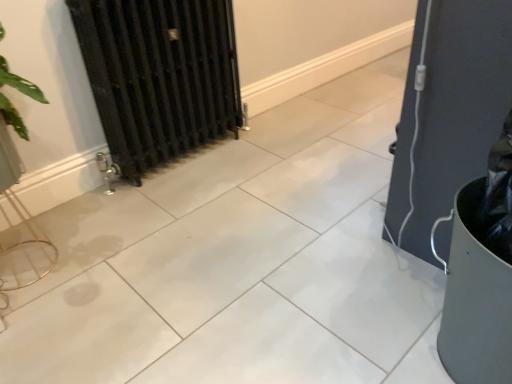
Question: Does matte black guitar case at right appear on the left side of black metal radiator at left?

Choices:
 (A) no
 (B) yes

Answer: (A)

Question: Is black metal radiator at left inside matte black guitar case at right?

Choices:
 (A) yes
 (B) no

Answer: (B)

Question: From a real-world perspective, is matte black guitar case at right physically below black metal radiator at left?

Choices:
 (A) no
 (B) yes

Answer: (B)

Question: From the image's perspective, is matte black guitar case at right under black metal radiator at left?

Choices:
 (A) no
 (B) yes

Answer: (B)

Question: Does matte black guitar case at right turn towards black metal radiator at left?

Choices:
 (A) no
 (B) yes

Answer: (B)

Question: From a real-world perspective, is matte black guitar case at right on top of black metal radiator at left?

Choices:
 (A) yes
 (B) no

Answer: (B)

Question: Is black metal radiator at left taller than matte black guitar case at right?

Choices:
 (A) yes
 (B) no

Answer: (A)

Question: Does black metal radiator at left appear on the right side of matte black guitar case at right?

Choices:
 (A) yes
 (B) no

Answer: (B)

Question: Can you confirm if black metal radiator at left is smaller than matte black guitar case at right?

Choices:
 (A) no
 (B) yes

Answer: (A)

Question: From the image's perspective, is black metal radiator at left above matte black guitar case at right?

Choices:
 (A) yes
 (B) no

Answer: (A)

Question: Is black metal radiator at left located outside matte black guitar case at right?

Choices:
 (A) no
 (B) yes

Answer: (B)

Question: From a real-world perspective, is black metal radiator at left under matte black guitar case at right?

Choices:
 (A) no
 (B) yes

Answer: (A)

Question: Based on their positions, is matte black guitar case at right located to the left or right of black metal radiator at left?

Choices:
 (A) left
 (B) right

Answer: (B)